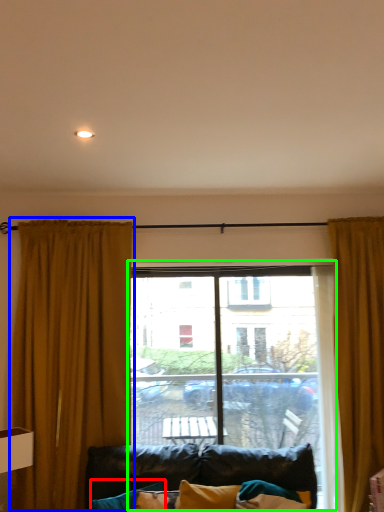
Question: Which object is positioned farthest from pillow (highlighted by a red box)? Select from curtain (highlighted by a blue box) and window (highlighted by a green box).

Choices:
 (A) curtain
 (B) window

Answer: (B)